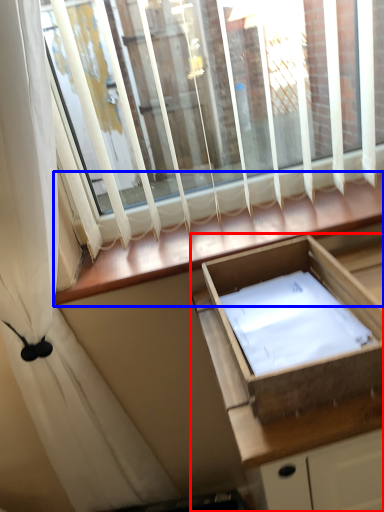
Question: Which point is further to the camera, cabinetry (highlighted by a red box) or window sill (highlighted by a blue box)?

Choices:
 (A) cabinetry
 (B) window sill

Answer: (B)